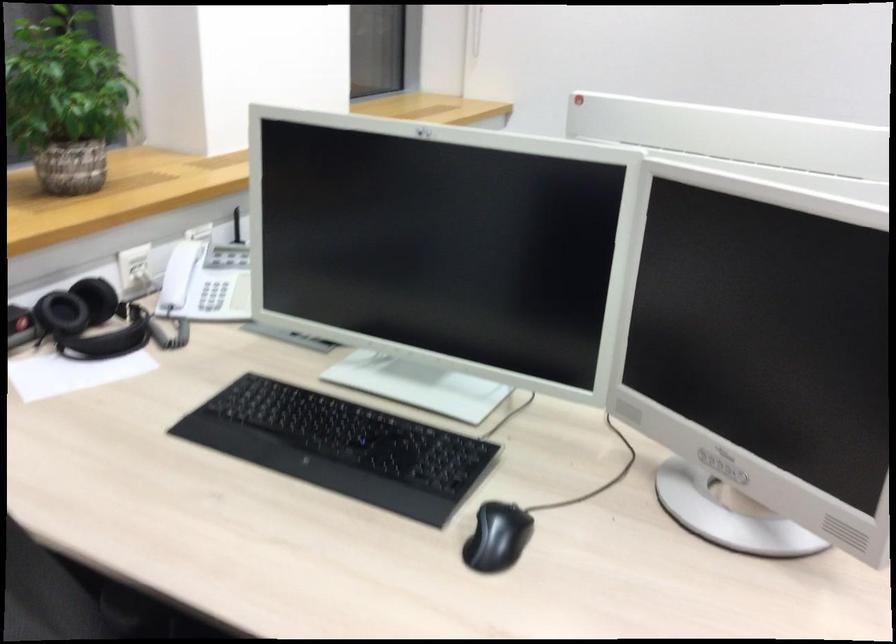
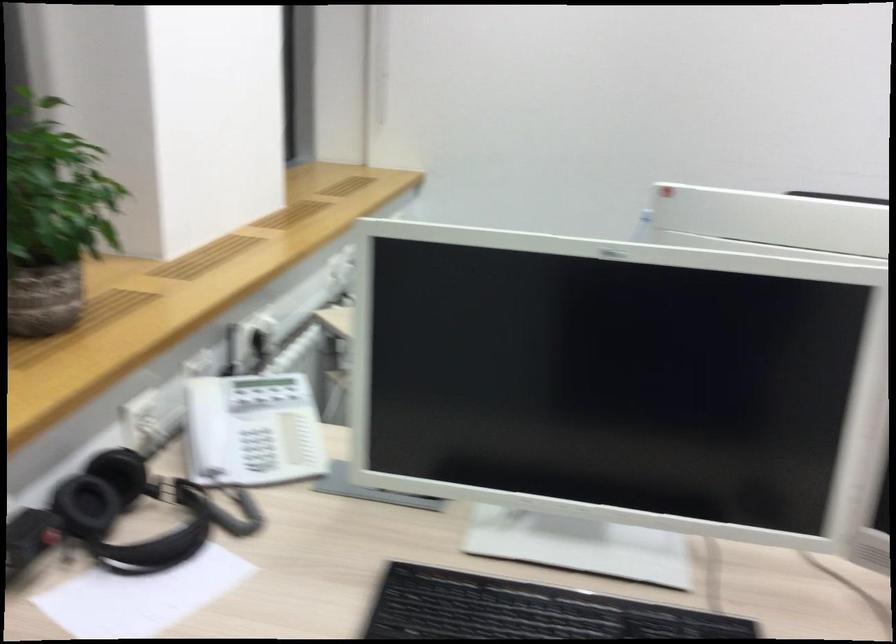
What movement of the cameraman would produce the second image?

The cameraman walked toward left, forward.